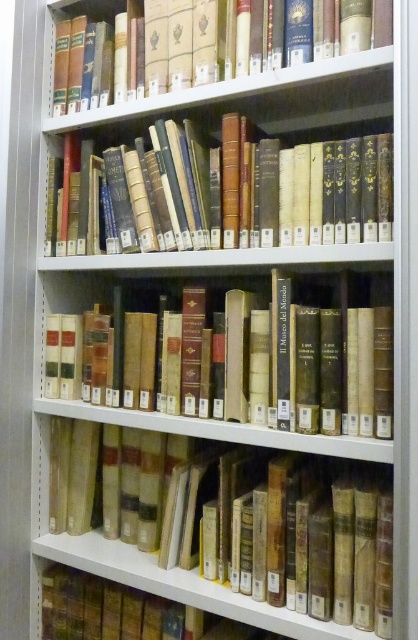
Question: Among these objects, which one is farthest from the camera?

Choices:
 (A) brown leather book at center
 (B) leather-bound books at center
 (C) yellowish paper book at center
 (D) hardcover books at upper center

Answer: (D)

Question: Is yellowish paper book at center positioned in front of brown leather book at center?

Choices:
 (A) no
 (B) yes

Answer: (B)

Question: Based on their relative distances, which object is farther from the leather-bound books at center?

Choices:
 (A) hardcover books at upper center
 (B) brown leather book at center

Answer: (B)

Question: Is leather-bound books at center to the right of hardcover books at upper center from the viewer's perspective?

Choices:
 (A) yes
 (B) no

Answer: (A)

Question: Does yellowish paper book at center appear over leather-bound books at center?

Choices:
 (A) yes
 (B) no

Answer: (B)

Question: Among these points, which one is nearest to the camera?

Choices:
 (A) (148, 449)
 (B) (234, 83)

Answer: (B)